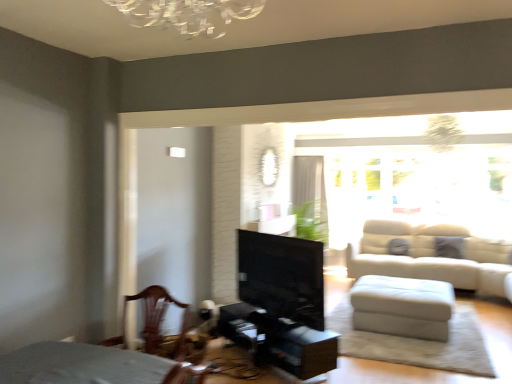
Question: From their relative heights in the image, would you say white sheer curtain at upper center is taller or shorter than transparent glass window at upper right?

Choices:
 (A) tall
 (B) short

Answer: (A)

Question: From the image's perspective, relative to transparent glass window at upper right, is white sheer curtain at upper center above or below?

Choices:
 (A) above
 (B) below

Answer: (B)

Question: Which object is positioned closest to the black glossy fireplace at center?

Choices:
 (A) white sheer curtain at upper center
 (B) white leather ottoman at lower right
 (C) transparent glass window at upper right
 (D) wooden chair at lower left

Answer: (D)

Question: Which is nearer to the transparent glass window at upper right?

Choices:
 (A) black glossy fireplace at center
 (B) wooden chair at lower left
 (C) white leather ottoman at lower right
 (D) white sheer curtain at upper center

Answer: (D)